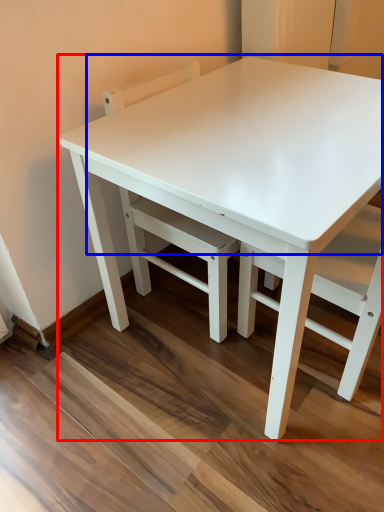
Question: Among these objects, which one is nearest to the camera, table (highlighted by a red box) or table top (highlighted by a blue box)?

Choices:
 (A) table
 (B) table top

Answer: (A)